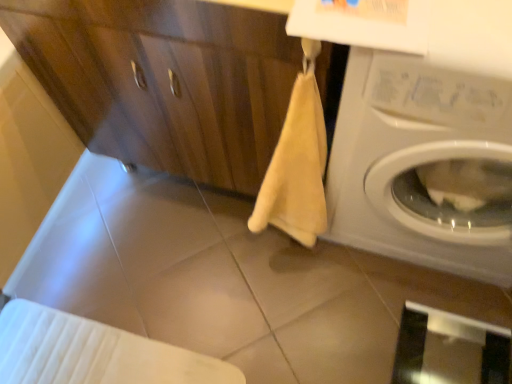
I want to click on vacant space behind transparent glass screen door at lower right, so click(x=408, y=290).